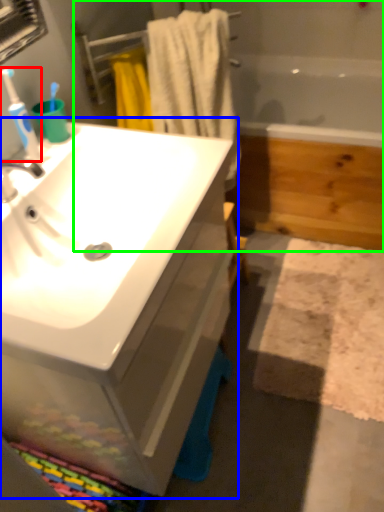
Question: Estimate the real-world distances between objects in this image. Which object is farther from toothbrush (highlighted by a red box), bathroom cabinet (highlighted by a blue box) or bath (highlighted by a green box)?

Choices:
 (A) bathroom cabinet
 (B) bath

Answer: (B)